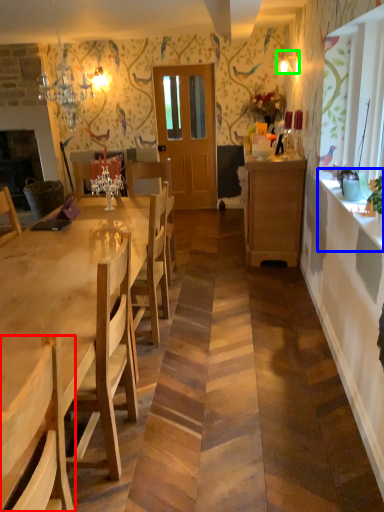
Question: Which object is the closest to the chair (highlighted by a red box)? Choose among these: counter top (highlighted by a blue box) or lamp (highlighted by a green box).

Choices:
 (A) counter top
 (B) lamp

Answer: (A)